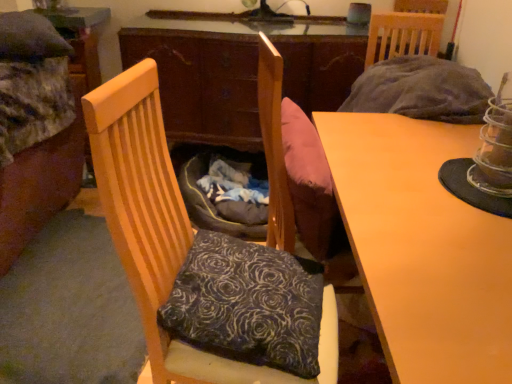
Question: Considering their positions, is wooden chair at left located in front of or behind matte wood desk at center?

Choices:
 (A) front
 (B) behind

Answer: (B)

Question: Looking at the image, does wooden chair at left seem bigger or smaller compared to matte wood desk at center?

Choices:
 (A) big
 (B) small

Answer: (B)

Question: Which object is positioned closest to the wooden chair at left?

Choices:
 (A) velvet floral pillow at center
 (B) matte wood desk at center
 (C) velvet fabric bed at left

Answer: (A)

Question: Which object is positioned farthest from the matte wood desk at center?

Choices:
 (A) velvet fabric bed at left
 (B) velvet floral pillow at center
 (C) wooden chair at left

Answer: (A)